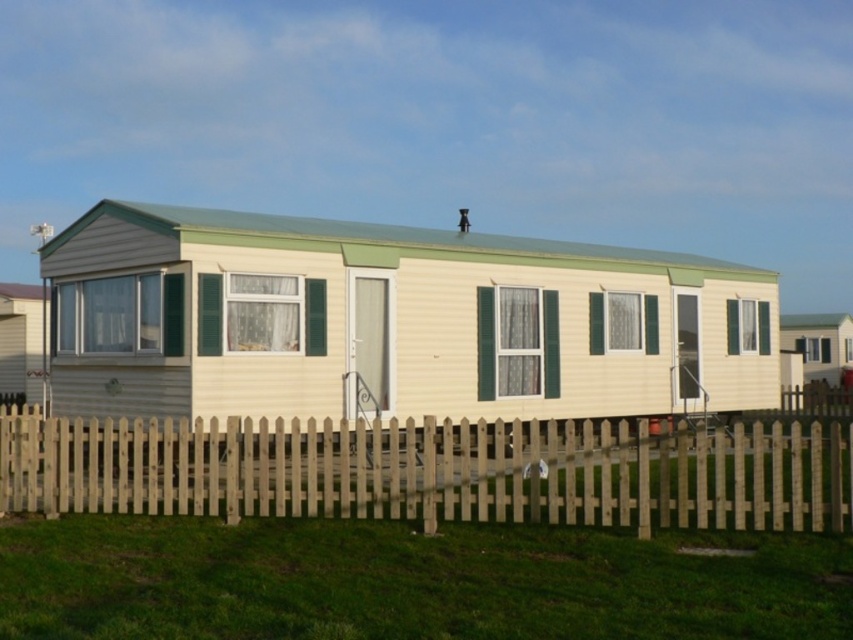
You are standing outside the mobile home and want to know if you can see the top of the matte yellow trailer at center from behind the wooden picket fence at lower center. Can you see it?

The matte yellow trailer at center is much taller than the wooden picket fence at lower center, so yes, you can see the top of the matte yellow trailer at center from behind the wooden picket fence at lower center.

Consider the image. You are planning to install a new garden bed between the matte yellow trailer at center and the green grass at lower center. The garden bed requires a minimum of 40 feet of space. Based on the scene, will there be enough space for the garden bed?

The distance between the matte yellow trailer at center and the green grass at lower center is 38.09 feet, which is less than the required 40 feet. Therefore, there is not enough space for the garden bed.